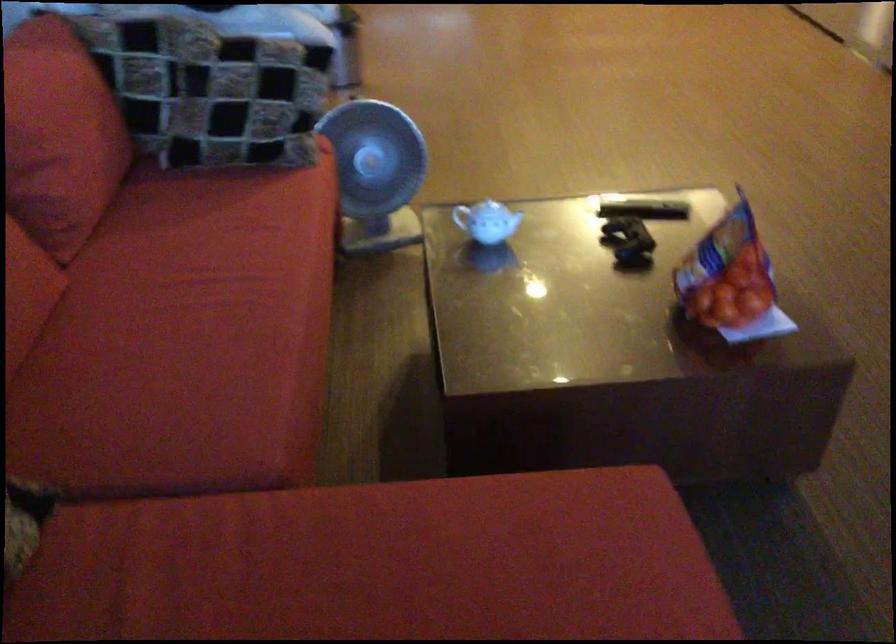
Describe the element at coordinates (192, 330) in the screenshot. This screenshot has width=896, height=644. I see `a sofa sitting surface` at that location.